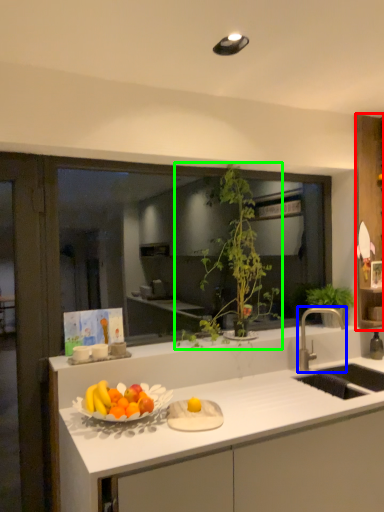
Question: Estimate the real-world distances between objects in this image. Which object is farther from cabinetry (highlighted by a red box), tap (highlighted by a blue box) or houseplant (highlighted by a green box)?

Choices:
 (A) tap
 (B) houseplant

Answer: (B)